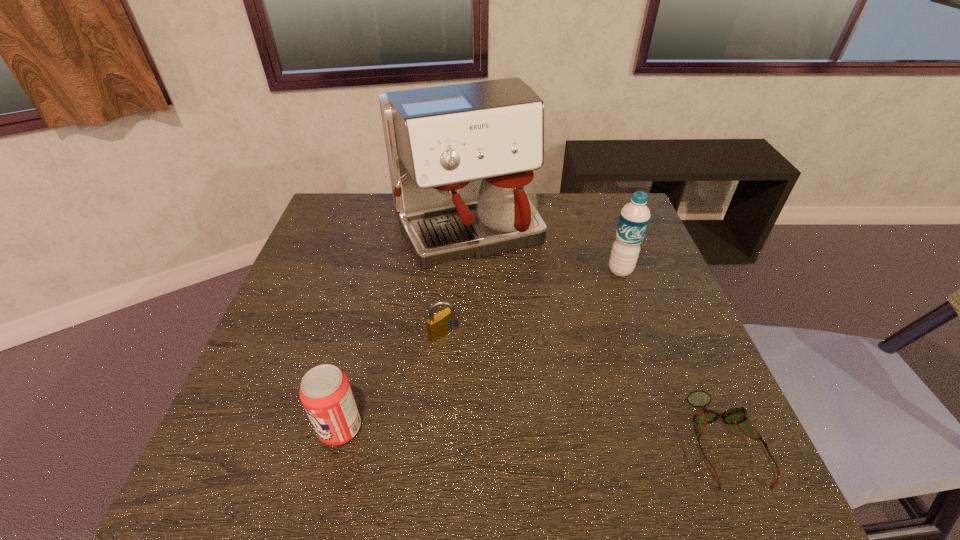
Locate an element on the screen. free space located on the label of the water bottle is located at coordinates (591, 347).

At what (x,y) coordinates should I click in order to perform the action: click on vacant region located 0.080m on the label of the water bottle. Please return your answer as a coordinate pair (x, y). The width and height of the screenshot is (960, 540). Looking at the image, I should click on 610,297.

Where is `free spot located on the side with the combination dials of the third farthest object`? free spot located on the side with the combination dials of the third farthest object is located at coordinates (527, 409).

You are a GUI agent. You are given a task and a screenshot of the screen. Output one action in this format:
    pyautogui.click(x=<x>, y=<y>)
    Task: Click on the vacant space situated on the side with the combination dials of the third farthest object
    The image size is (960, 540).
    Given the screenshot: What is the action you would take?
    pyautogui.click(x=513, y=396)

Locate an element on the screen. The height and width of the screenshot is (540, 960). blank space located 0.170m on the side with the combination dials of the third farthest object is located at coordinates (503, 387).

Image resolution: width=960 pixels, height=540 pixels. I want to click on vacant space positioned 0.200m on the front of the tallest object near the spout, so click(x=522, y=333).

Identify the location of vacant region located 0.340m on the front of the tallest object near the spout. (548, 380).

This screenshot has height=540, width=960. What are the coordinates of `free location located 0.190m on the front of the tallest object near the spout` in the screenshot? It's located at (521, 329).

Image resolution: width=960 pixels, height=540 pixels. In order to click on object that is at the far edge in this screenshot , I will do 461,157.

Find the location of a particular element. The width and height of the screenshot is (960, 540). soda can that is at the near edge is located at coordinates (325, 392).